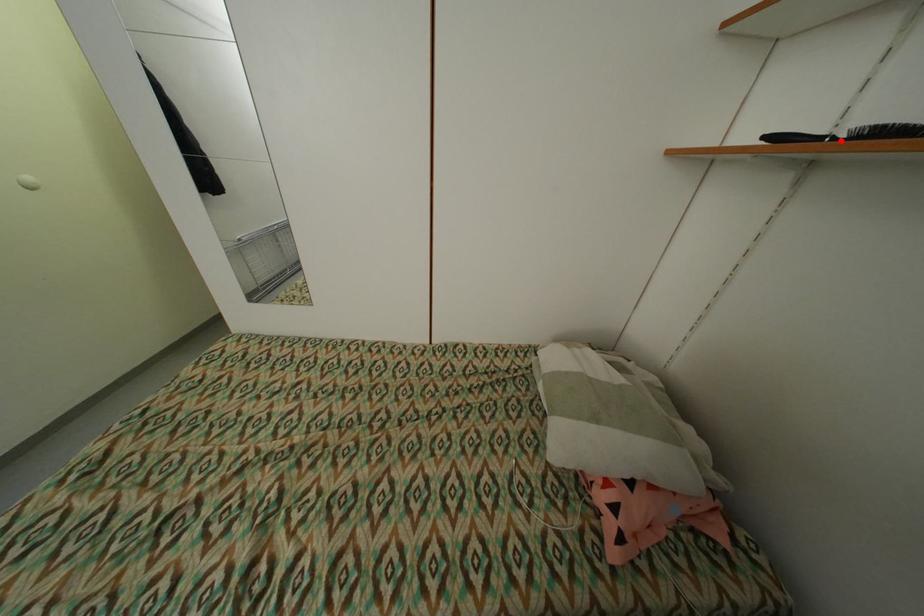
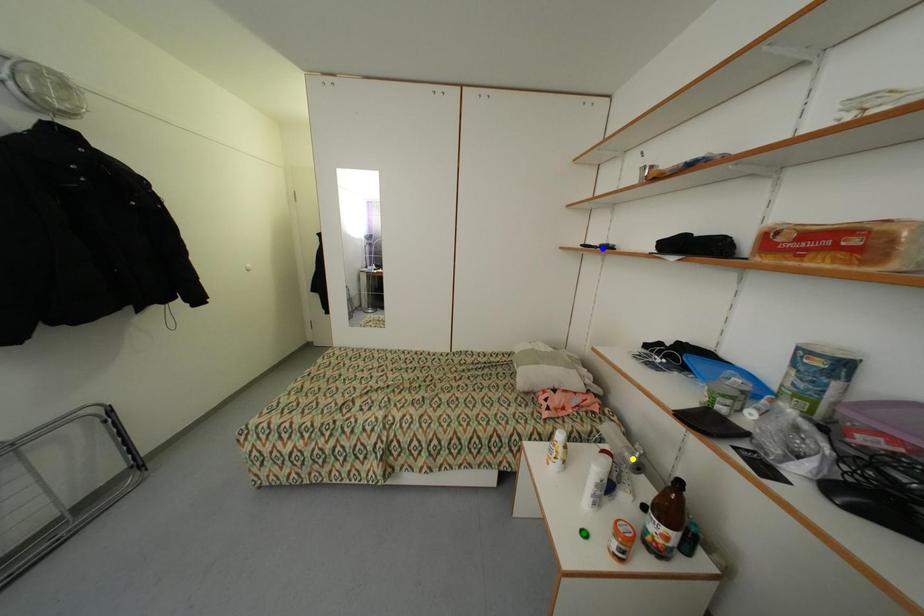
Question: I am providing you with two images of the same scene from different viewpoints. A red point is marked on the first image. You are given multiple points on the second image. Which mark in image 2 goes with the point in image 1?

Choices:
 (A) blue point
 (B) yellow point
 (C) green point

Answer: (A)